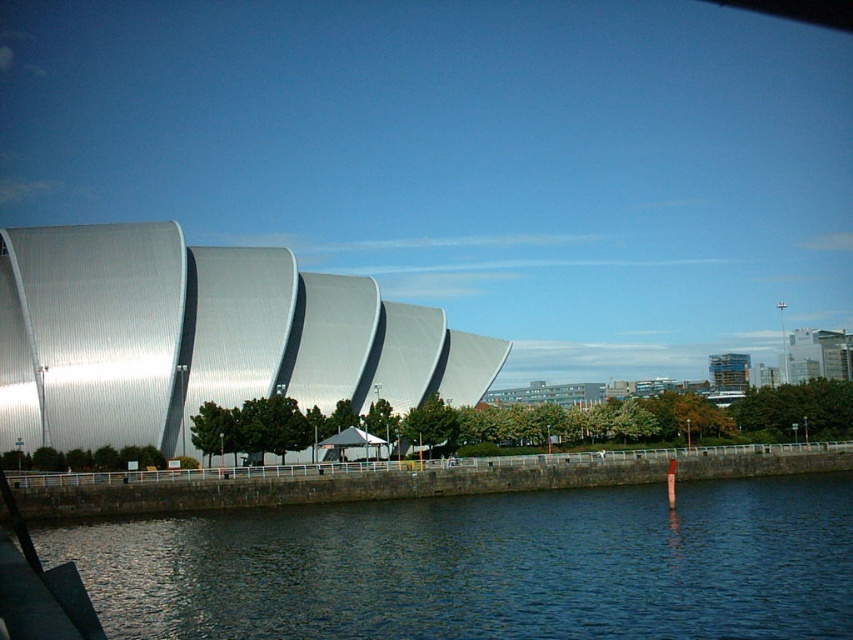
Question: Considering the relative positions of dark blue water at lower center and shiny metallic building at left in the image provided, where is dark blue water at lower center located with respect to shiny metallic building at left?

Choices:
 (A) right
 (B) left

Answer: (A)

Question: Which object appears closest to the camera in this image?

Choices:
 (A) dark blue water at lower center
 (B) shiny metallic building at left

Answer: (A)

Question: Does dark blue water at lower center appear on the right side of shiny metallic building at left?

Choices:
 (A) yes
 (B) no

Answer: (A)

Question: Does dark blue water at lower center come behind shiny metallic building at left?

Choices:
 (A) no
 (B) yes

Answer: (A)

Question: Which object appears closest to the camera in this image?

Choices:
 (A) shiny metallic building at left
 (B) dark blue water at lower center

Answer: (B)